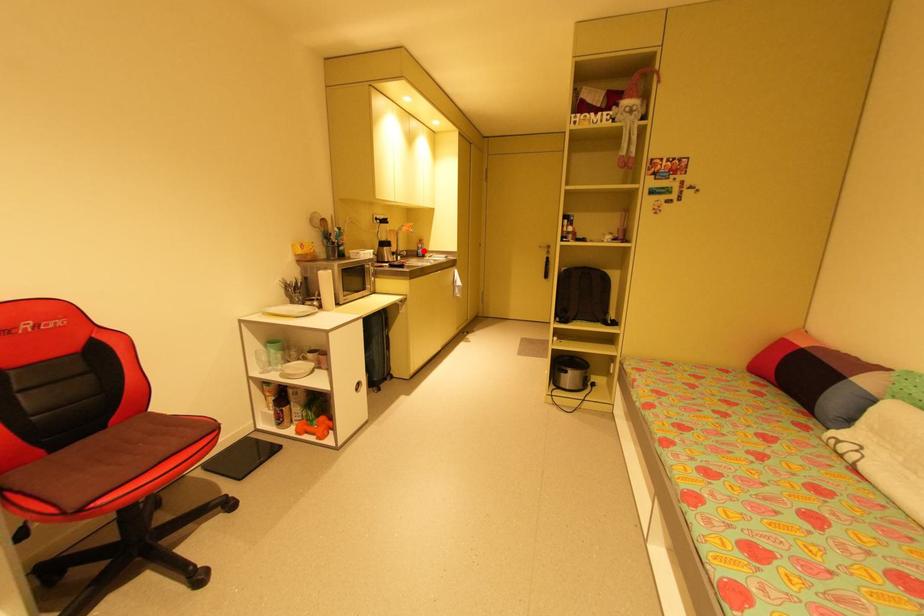
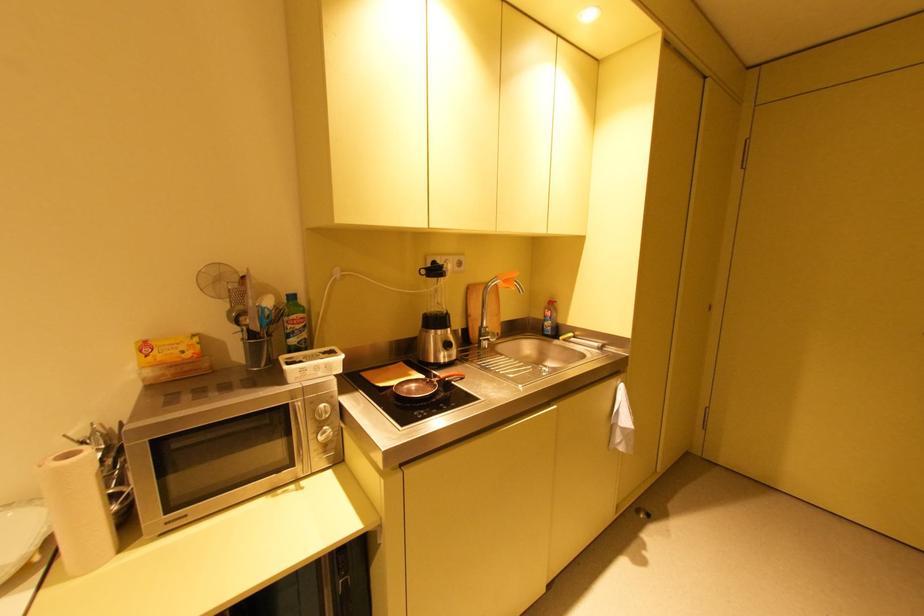
Locate, in the second image, the point that corresponds to the highlighted location in the first image.

(551, 323)